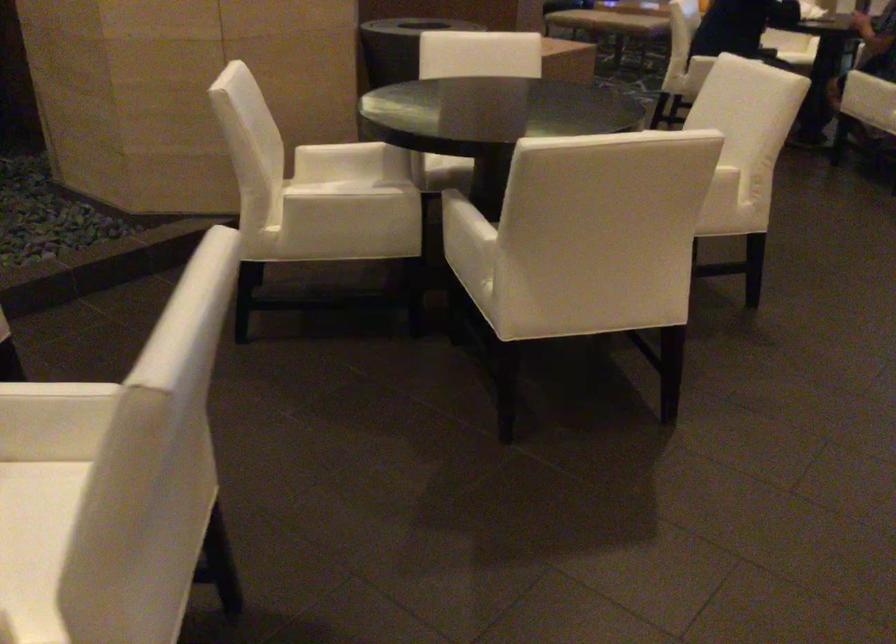
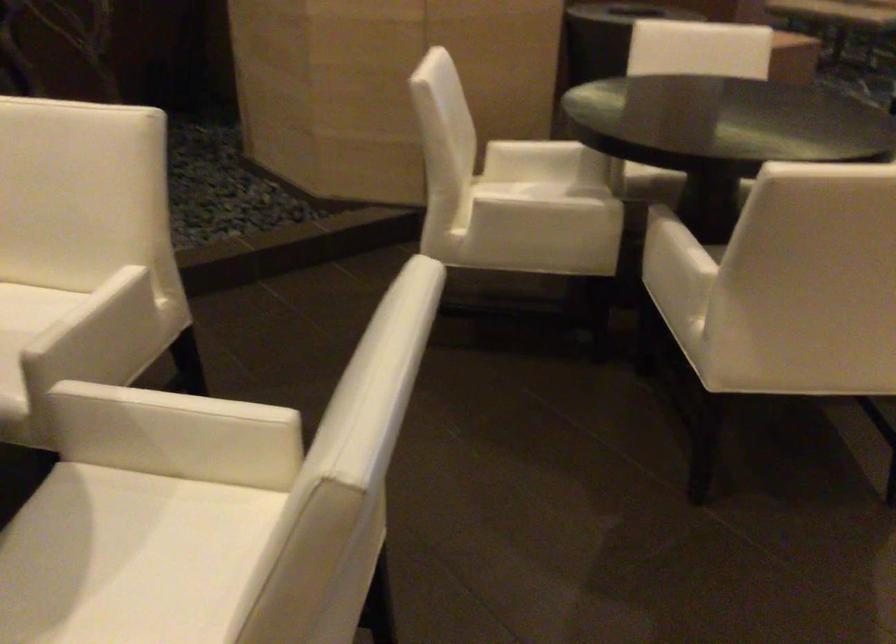
The point at (333,185) is marked in the first image. Where is the corresponding point in the second image?

(530, 189)